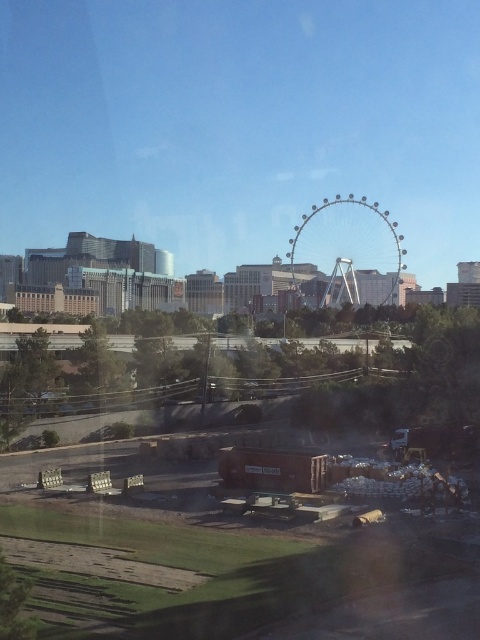
You are standing at the point labeled as point [271,518] in the image. Looking around, you see the Ferris wheel in the midground and the construction site in the foreground. What is the nearest object to you?

The nearest object to you is the brown wooden pallets at lower left because the point [271,518] is located on them, making them the closest in proximity.

You are a construction worker standing at the lower left corner of the scene. You need to move a heavy object from the brown wooden pallets at lower left to the base of the metallic silver ferris wheel at center. Considering their heights, will you need to lift the object higher to place it at the base of the ferris wheel?

The brown wooden pallets at lower left is not as tall as the metallic silver ferris wheel at center. Therefore, you will need to lift the object higher to place it at the base of the metallic silver ferris wheel at center since the ferris wheel is taller.

You are standing at the Ferris wheel and want to reach the point marked at coordinates point [218,538]. Considering the construction site in the foreground, can you walk directly to that point without crossing any obstacles?

The distance of point [218,538] from camera is 120.95 feet. Since the construction site is in the foreground, which is closer to the camera, you would have to walk through the construction site to reach the point. However, the construction site has earth mounds and construction materials, so there might be obstacles in the way.